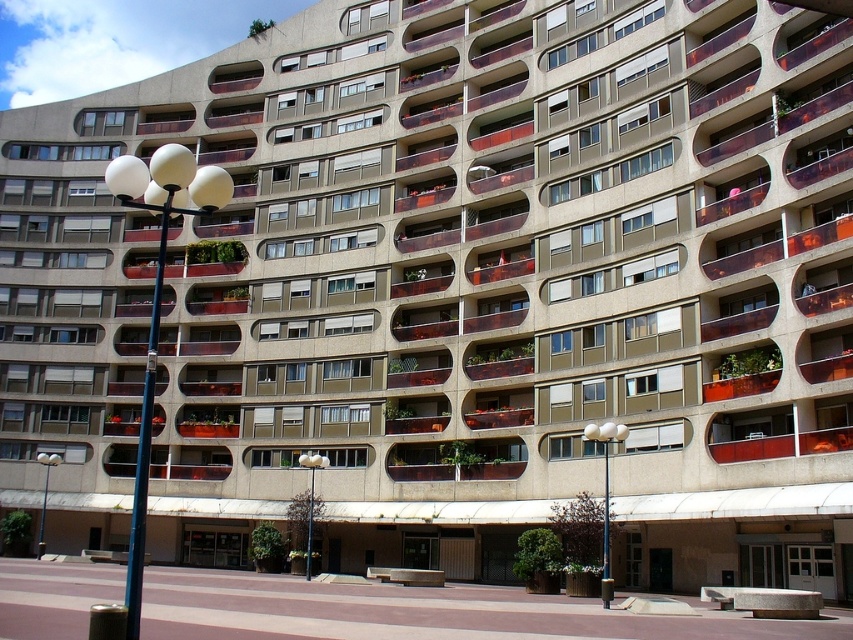
Based on the photo, you are standing at the entrance of the residential building and want to locate the metallic streetlight at center. According to the coordinates provided, where would you find it?

The metallic streetlight at center is located at point coordinates of 0.781 in the x axis and 0.366 in the y axis.

You are standing at the entrance of the residential building and want to walk towards the metallic streetlight at center. Which direction should you turn to avoid the white glossy lamp post at left?

To avoid the white glossy lamp post at left, you should turn to the right since the metallic streetlight at center is to the right of the white glossy lamp post at left.

You are standing in front of the residential building and notice two points marked on the pavement. The first point is at coordinates point (131, 586) and the second is at point (300, 456). Which point is closer to your current position?

Point (131, 586) is closer to the camera than point (300, 456), so the first point is closer to your current position.